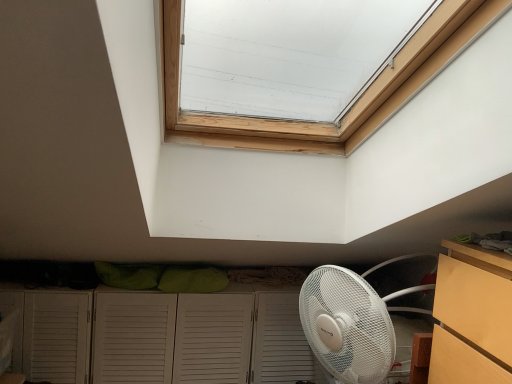
Image resolution: width=512 pixels, height=384 pixels. What do you see at coordinates (169, 338) in the screenshot?
I see `white matte dresser at lower right` at bounding box center [169, 338].

Find the location of `white matte dresser at lower right`. white matte dresser at lower right is located at coordinates (169, 338).

Find the location of a particular element. This screenshot has width=512, height=384. white matte dresser at lower right is located at coordinates (169, 338).